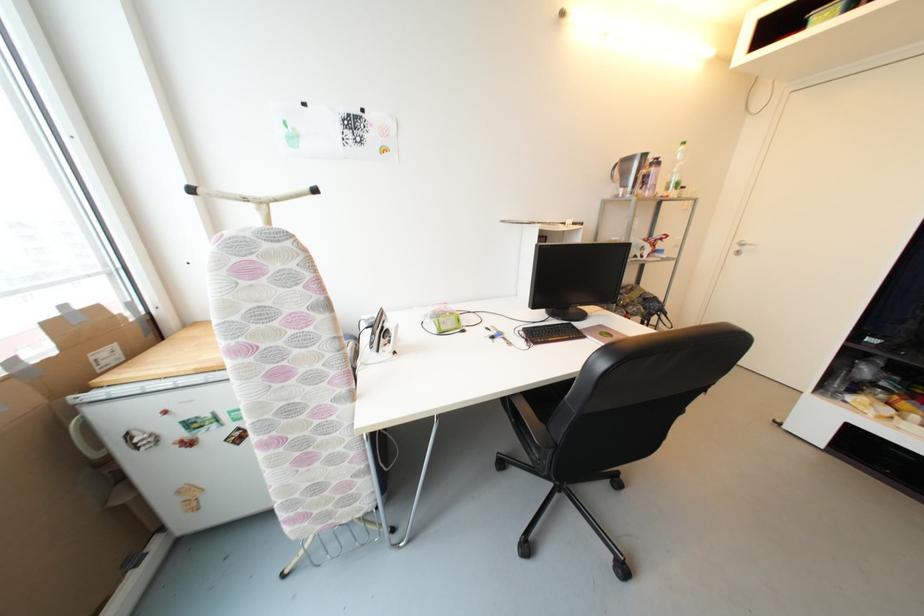
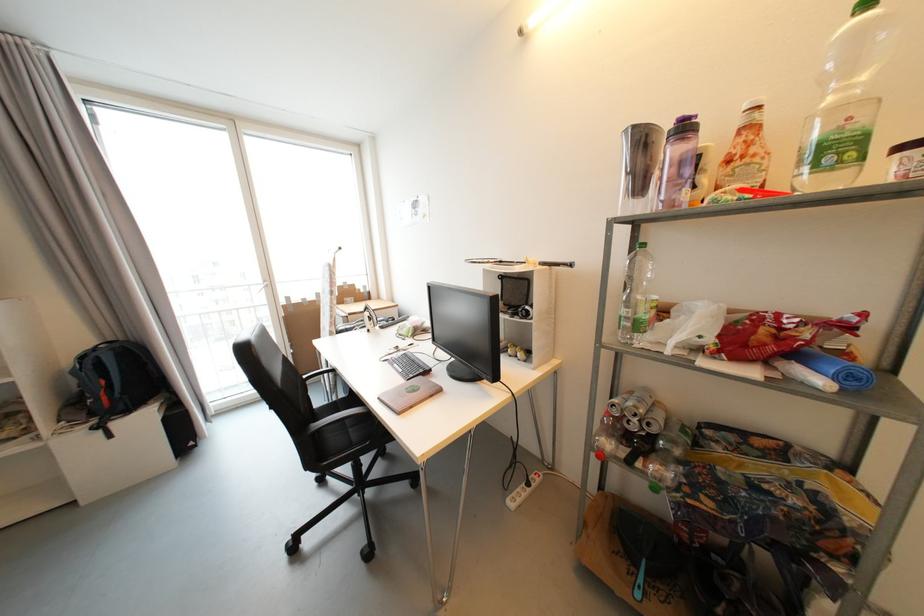
The point at (682, 187) is marked in the first image. Where is the corresponding point in the second image?

(842, 151)